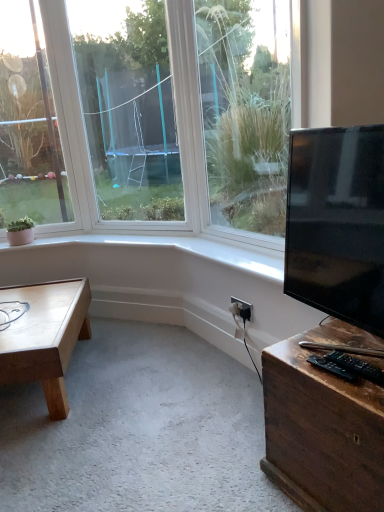
Identify the location of free space to the left of black plastic remote control at lower right, the 2th wide viewed from the right. (300, 370).